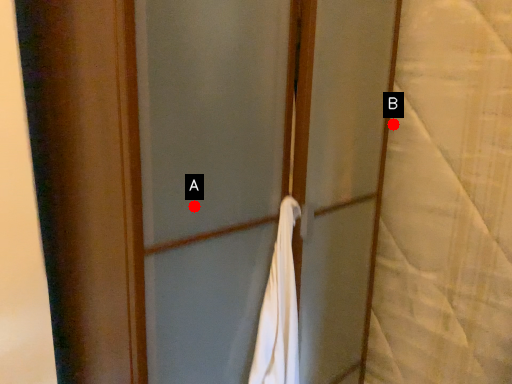
Question: Two points are circled on the image, labeled by A and B beside each circle. Which point is farther from the camera taking this photo?

Choices:
 (A) A is further
 (B) B is further

Answer: (B)